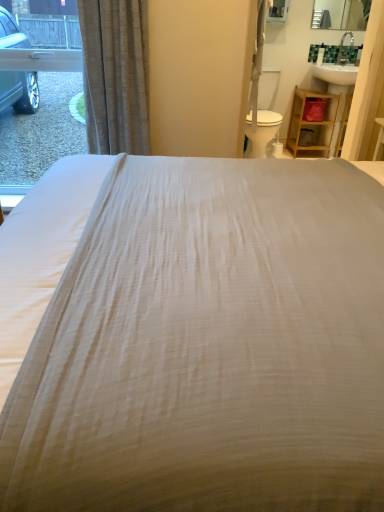
Image resolution: width=384 pixels, height=512 pixels. What do you see at coordinates (209, 346) in the screenshot? I see `white textured bed at center` at bounding box center [209, 346].

The height and width of the screenshot is (512, 384). In order to click on white textured bed at center in this screenshot , I will do `click(209, 346)`.

The image size is (384, 512). Identify the location of clear glass window at left. (43, 105).

What do you see at coordinates (262, 115) in the screenshot? I see `white plastic swivel chair at center-right` at bounding box center [262, 115].

The width and height of the screenshot is (384, 512). What do you see at coordinates (312, 122) in the screenshot?
I see `wooden shelf at right` at bounding box center [312, 122].

The height and width of the screenshot is (512, 384). I want to click on silky beige curtain at left, so click(115, 75).

From the picture: Relative to silky beige curtain at left, is white plastic swivel chair at center-right in front or behind?

white plastic swivel chair at center-right is behind silky beige curtain at left.

Which is closer, (262, 78) or (114, 5)?

Point (262, 78).

Can you confirm if white plastic swivel chair at center-right is bigger than silky beige curtain at left?

Indeed, white plastic swivel chair at center-right has a larger size compared to silky beige curtain at left.

Would you say white plastic swivel chair at center-right is inside or outside silky beige curtain at left?

white plastic swivel chair at center-right cannot be found inside silky beige curtain at left.

Which is less distant, (188, 462) or (78, 120)?

Point (188, 462) is closer to the camera than point (78, 120).

From the image's perspective, is white textured bed at center beneath clear glass window at left?

Yes, from the image's perspective, white textured bed at center is beneath clear glass window at left.

Which of these two, white textured bed at center or clear glass window at left, is bigger?

white textured bed at center is bigger.

Would you say white textured bed at center is to the left or to the right of clear glass window at left in the picture?

white textured bed at center is to the right of clear glass window at left.

Is wooden shelf at right completely or partially outside of clear glass window at left?

wooden shelf at right lies outside clear glass window at left's area.

From a real-world perspective, is wooden shelf at right over clear glass window at left?

No.

Is point (294, 94) less distant than point (9, 170)?

No.

Where is `furniture on the right of clear glass window at left`? The width and height of the screenshot is (384, 512). furniture on the right of clear glass window at left is located at coordinates (x=312, y=122).

Considering the points (258, 152) and (141, 330), which point is behind, point (258, 152) or point (141, 330)?

The point (258, 152) is more distant.

Is white plastic swivel chair at center-right not near white textured bed at center?

Yes, white plastic swivel chair at center-right and white textured bed at center are located far from each other.

Which of these two, white plastic swivel chair at center-right or white textured bed at center, is bigger?

With larger size is white textured bed at center.

From the image's perspective, is white plastic swivel chair at center-right under white textured bed at center?

Incorrect, from the image's perspective, white plastic swivel chair at center-right is higher than white textured bed at center.

What's the angular difference between clear glass window at left and white plastic swivel chair at center-right's facing directions?

The angle between the facing direction of clear glass window at left and the facing direction of white plastic swivel chair at center-right is 1.24 degrees.

From a real-world perspective, which object rests below the other?

white plastic swivel chair at center-right, from a real-world perspective.

Can you confirm if clear glass window at left is smaller than white plastic swivel chair at center-right?

Correct, clear glass window at left occupies less space than white plastic swivel chair at center-right.

Is there a large distance between clear glass window at left and white plastic swivel chair at center-right?

clear glass window at left is far away from white plastic swivel chair at center-right.

Is clear glass window at left a part of silky beige curtain at left?

That's incorrect, clear glass window at left is not inside silky beige curtain at left.

In the scene shown: From the image's perspective, relative to clear glass window at left, is silky beige curtain at left above or below?

silky beige curtain at left is below clear glass window at left.

Is point (138, 104) closer or farther from the camera than point (46, 54)?

Point (138, 104) is closer to the camera than point (46, 54).

The height and width of the screenshot is (512, 384). I want to click on curtain on the right of clear glass window at left, so click(115, 75).

Who is smaller, silky beige curtain at left or white plastic swivel chair at center-right?

Smaller between the two is silky beige curtain at left.

Is silky beige curtain at left touching white plastic swivel chair at center-right?

No, silky beige curtain at left is not with white plastic swivel chair at center-right.

Is point (104, 150) closer or farther from the camera than point (256, 138)?

Clearly, point (104, 150) is closer to the camera than point (256, 138).

Which of these two, silky beige curtain at left or white plastic swivel chair at center-right, stands taller?

Standing taller between the two is silky beige curtain at left.

At what (x,y) coordinates should I click in order to perform the action: click on curtain located on the left of white plastic swivel chair at center-right. Please return your answer as a coordinate pair (x, y). Image resolution: width=384 pixels, height=512 pixels. Looking at the image, I should click on (115, 75).

Identify the location of window above the white textured bed at center (from a real-world perspective). (43, 105).

Looking at the image, which one is located closer to white textured bed at center, clear glass window at left or silky beige curtain at left?

silky beige curtain at left.

Based on the photo, when comparing their distances from wooden shelf at right, does clear glass window at left or white plastic swivel chair at center-right seem closer?

white plastic swivel chair at center-right.

Considering their positions, is wooden shelf at right positioned closer to white textured bed at center than silky beige curtain at left?

silky beige curtain at left is positioned closer to the anchor white textured bed at center.

Which object lies further to the anchor point clear glass window at left, white plastic swivel chair at center-right or silky beige curtain at left?

Among the two, white plastic swivel chair at center-right is located further to clear glass window at left.

Looking at the image, which one is located further to white textured bed at center, wooden shelf at right or white plastic swivel chair at center-right?

wooden shelf at right.

Looking at the image, which one is located further to wooden shelf at right, white textured bed at center or white plastic swivel chair at center-right?

white textured bed at center is positioned further to the anchor wooden shelf at right.

Looking at the image, which one is located closer to clear glass window at left, silky beige curtain at left or wooden shelf at right?

silky beige curtain at left is closer to clear glass window at left.

From the image, which object appears to be farther from wooden shelf at right, white plastic swivel chair at center-right or clear glass window at left?

Based on the image, clear glass window at left appears to be further to wooden shelf at right.

The width and height of the screenshot is (384, 512). Find the location of `window between white textured bed at center and wooden shelf at right along the z-axis`. window between white textured bed at center and wooden shelf at right along the z-axis is located at coordinates point(43,105).

Locate an element on the screen. The height and width of the screenshot is (512, 384). window between white textured bed at center and white plastic swivel chair at center-right in the front-back direction is located at coordinates (43, 105).

This screenshot has height=512, width=384. In order to click on curtain between white textured bed at center and wooden shelf at right from front to back in this screenshot , I will do tap(115, 75).

The height and width of the screenshot is (512, 384). Find the location of `swivel chair between silky beige curtain at left and wooden shelf at right in the front-back direction`. swivel chair between silky beige curtain at left and wooden shelf at right in the front-back direction is located at coordinates (262, 115).